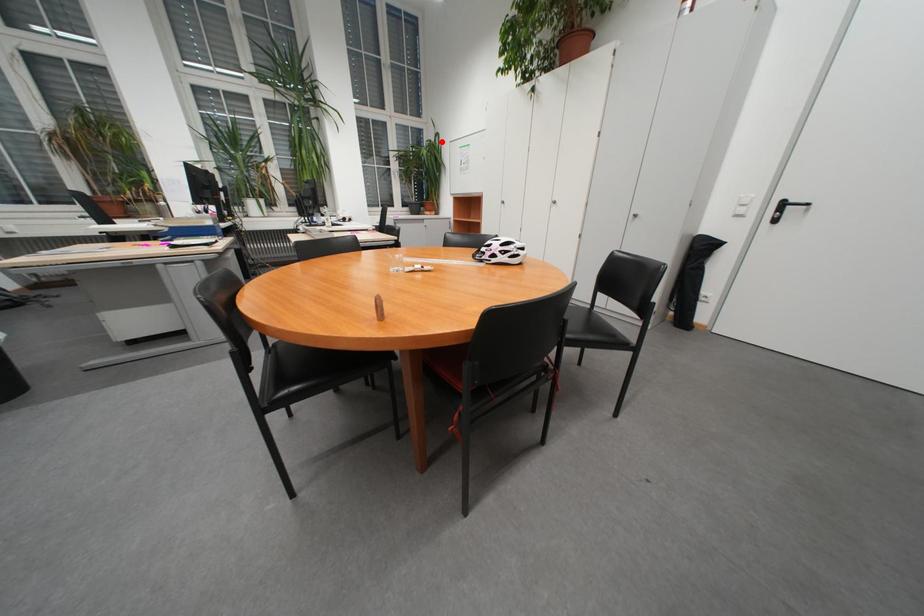
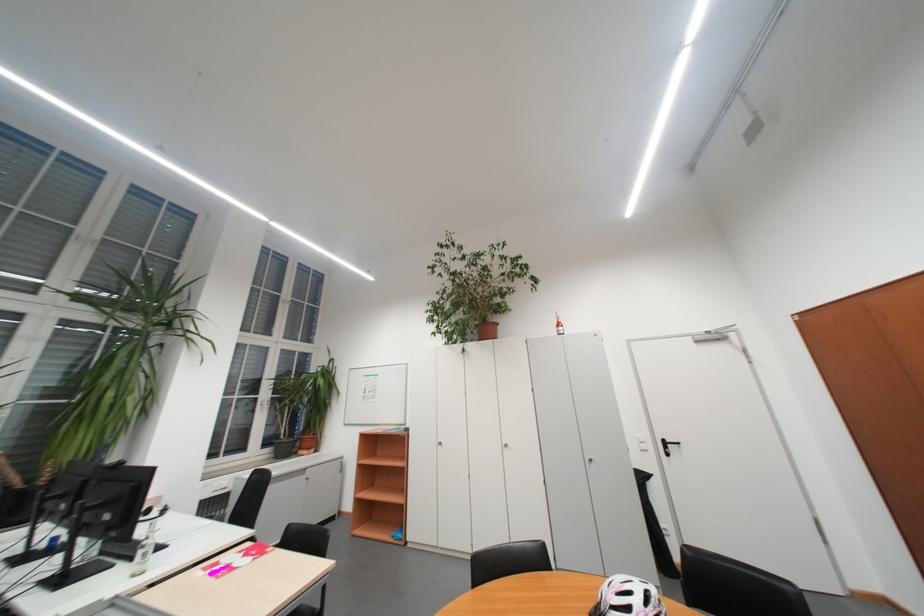
Where in the second image is the point corresponding to the highlighted location from the first image?

(334, 368)